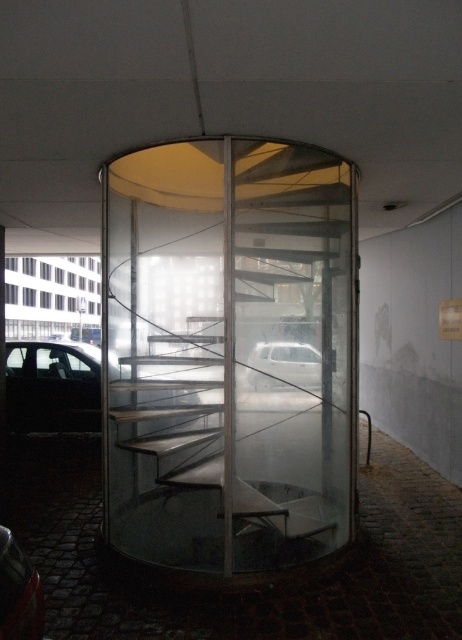
You are standing in front of the spiral staircase and want to reach the shiny red car at lower left. Can you walk directly towards it without any obstacles?

The shiny red car at lower left is 1.91 meters away from viewer, so yes, you can walk directly towards it since there are no obstacles mentioned in the scene description.

You are standing in a parking garage and see a transparent glass spiral staircase at center and a matte black car at left. Which object is positioned to the right side of the other?

The transparent glass spiral staircase at center is to the right of the matte black car at left.

You are a visitor standing at the entrance of the glass structure. You see the transparent glass spiral staircase at center and the white matte car at center. Which object is closer to your right side?

The white matte car at center is closer to your right side because the transparent glass spiral staircase at center is positioned on the left side of it.